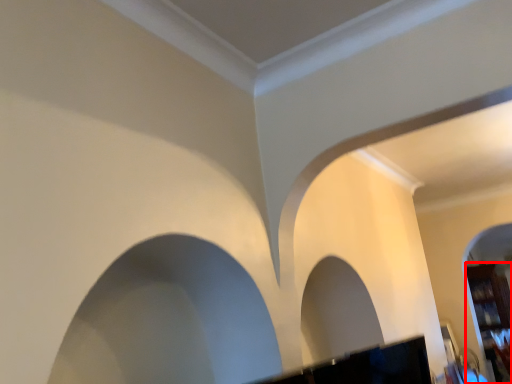
Question: From the image, what is the correct spatial relationship of furniture (annotated by the red box) in relation to rock arch?

Choices:
 (A) right
 (B) left

Answer: (A)